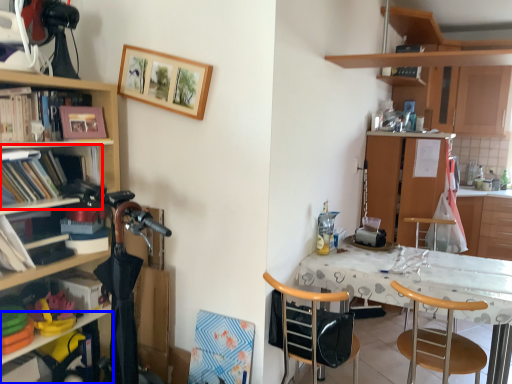
Question: Which object is further to the camera taking this photo, shelf (highlighted by a red box) or shelf (highlighted by a blue box)?

Choices:
 (A) shelf
 (B) shelf

Answer: (B)